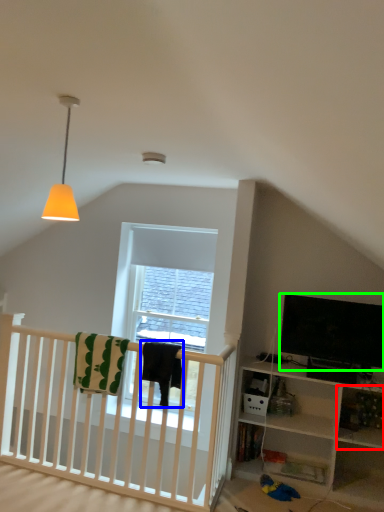
Question: Which object is the farthest from shelf (highlighted by a red box)? Choose among these: blanket (highlighted by a blue box) or television (highlighted by a green box).

Choices:
 (A) blanket
 (B) television

Answer: (A)